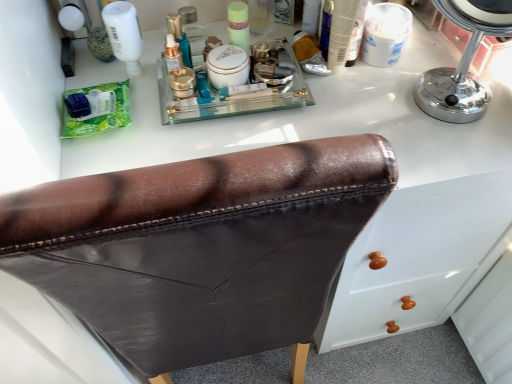
Question: Is brown leather chair at center at the left side of green matte packet at left?

Choices:
 (A) no
 (B) yes

Answer: (A)

Question: Does brown leather chair at center have a lesser height compared to green matte packet at left?

Choices:
 (A) yes
 (B) no

Answer: (B)

Question: Is green matte packet at left completely or partially inside brown leather chair at center?

Choices:
 (A) no
 (B) yes

Answer: (A)

Question: Does brown leather chair at center have a lesser width compared to green matte packet at left?

Choices:
 (A) yes
 (B) no

Answer: (B)

Question: Would you say brown leather chair at center is a long distance from green matte packet at left?

Choices:
 (A) yes
 (B) no

Answer: (B)

Question: Is brown leather chair at center taller or shorter than green matte packet at left?

Choices:
 (A) tall
 (B) short

Answer: (A)

Question: Is brown leather chair at center inside or outside of green matte packet at left?

Choices:
 (A) inside
 (B) outside

Answer: (B)

Question: Is brown leather chair at center to the left or to the right of green matte packet at left in the image?

Choices:
 (A) left
 (B) right

Answer: (B)

Question: From a real-world perspective, is brown leather chair at center above or below green matte packet at left?

Choices:
 (A) above
 (B) below

Answer: (B)

Question: Does point (451, 96) appear closer or farther from the camera than point (102, 89)?

Choices:
 (A) farther
 (B) closer

Answer: (B)

Question: Considering the positions of chrome/metallic mirror at upper right and green matte packet at left in the image, is chrome/metallic mirror at upper right bigger or smaller than green matte packet at left?

Choices:
 (A) small
 (B) big

Answer: (B)

Question: Would you say chrome/metallic mirror at upper right is to the left or to the right of green matte packet at left in the picture?

Choices:
 (A) right
 (B) left

Answer: (A)

Question: Is chrome/metallic mirror at upper right in front of or behind green matte packet at left in the image?

Choices:
 (A) behind
 (B) front

Answer: (B)

Question: Is point (116, 102) positioned closer to the camera than point (248, 52)?

Choices:
 (A) closer
 (B) farther

Answer: (A)

Question: From the image's perspective, is green matte packet at left located above or below matte green jar at center?

Choices:
 (A) above
 (B) below

Answer: (B)